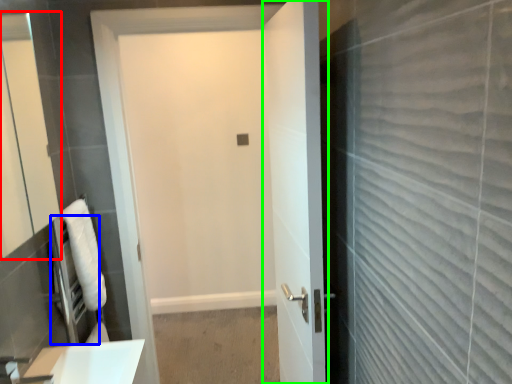
Question: Based on their relative distances, which object is farther from mirror (highlighted by a red box)? Choose from appliance (highlighted by a blue box) and door (highlighted by a green box).

Choices:
 (A) appliance
 (B) door

Answer: (B)